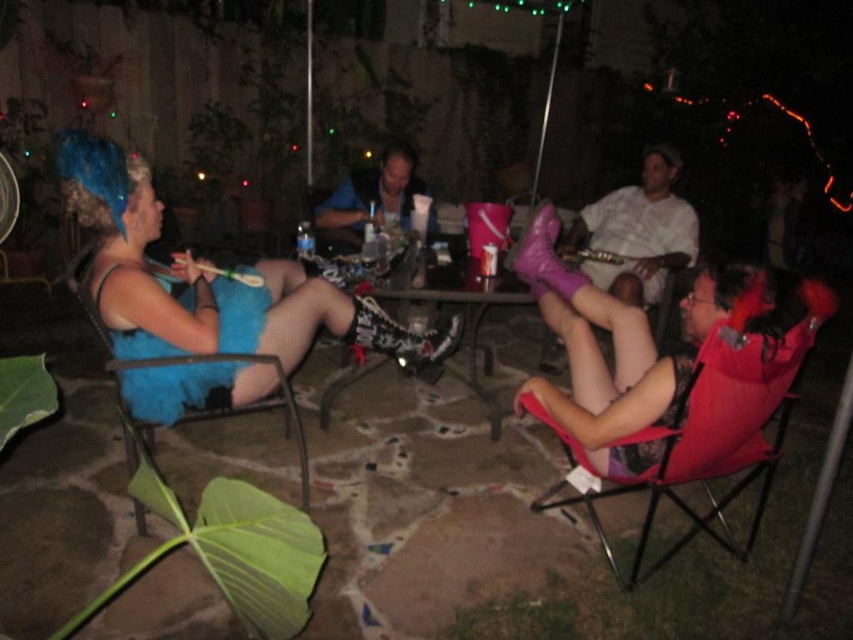
Can you confirm if blue fuzzy dress at left is bigger than matte pink fabric chair at lower right?

Yes, blue fuzzy dress at left is bigger than matte pink fabric chair at lower right.

Which is below, blue fuzzy dress at left or matte pink fabric chair at lower right?

Positioned lower is blue fuzzy dress at left.

I want to click on blue fuzzy dress at left, so pos(184,368).

Between blue mesh dress at left and matte pink fabric chair at lower right, which one has less height?

Standing shorter between the two is matte pink fabric chair at lower right.

This screenshot has height=640, width=853. What do you see at coordinates (207, 280) in the screenshot? I see `blue mesh dress at left` at bounding box center [207, 280].

You are a GUI agent. You are given a task and a screenshot of the screen. Output one action in this format:
    pyautogui.click(x=<x>, y=<y>)
    Task: Click on the blue mesh dress at left
    Image resolution: width=853 pixels, height=640 pixels.
    Given the screenshot: What is the action you would take?
    pyautogui.click(x=207, y=280)

Does matte red folding chair at lower right have a greater width compared to matte pink fabric chair at lower right?

Yes, matte red folding chair at lower right is wider than matte pink fabric chair at lower right.

Is point (686, 513) in front of point (572, 230)?

Yes.

Is point (523, 396) closer to camera compared to point (548, 348)?

That is True.

This screenshot has height=640, width=853. In order to click on matte red folding chair at lower right in this screenshot , I will do `click(706, 422)`.